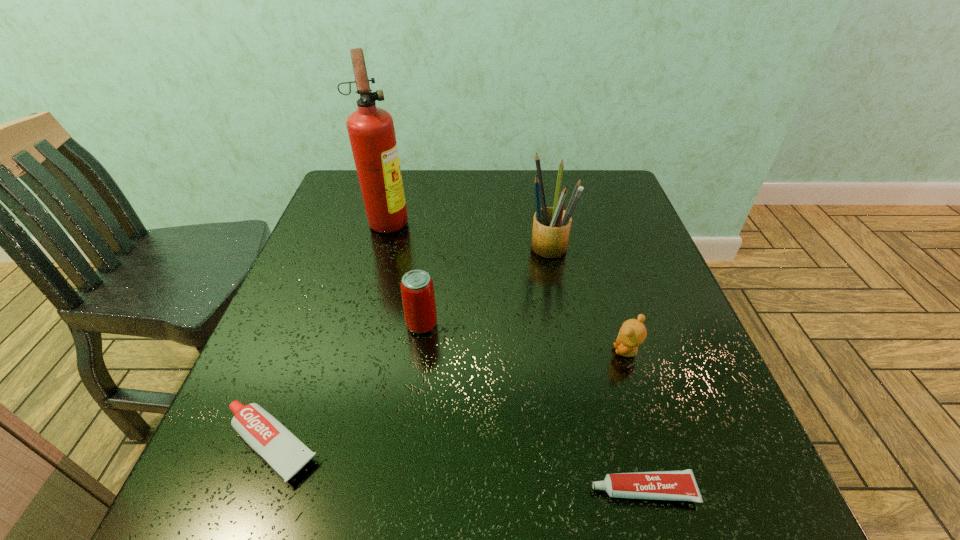
The width and height of the screenshot is (960, 540). In order to click on vacant space in between the tallest object and the taller toothpaste in this screenshot , I will do `click(329, 333)`.

At what (x,y) coordinates should I click in order to perform the action: click on free space between the second tallest object and the third tallest object. Please return your answer as a coordinate pair (x, y). The image size is (960, 540). Looking at the image, I should click on (486, 286).

The width and height of the screenshot is (960, 540). Find the location of `unoccupied area between the fifth tallest object and the teddy bear`. unoccupied area between the fifth tallest object and the teddy bear is located at coordinates (449, 398).

The width and height of the screenshot is (960, 540). What are the coordinates of `object that is the closest one to the fifth shortest object` in the screenshot? It's located at (633, 332).

I want to click on the third closest object to the third farthest object, so click(x=371, y=131).

The width and height of the screenshot is (960, 540). I want to click on free location that satisfies the following two spatial constraints: 1. on the back side of the left toothpaste; 2. on the left side of the beer can, so click(x=316, y=324).

The height and width of the screenshot is (540, 960). Identify the location of free region that satisfies the following two spatial constraints: 1. on the back side of the left toothpaste; 2. on the right side of the fourth object from right to left. (316, 324).

At what (x,y) coordinates should I click in order to perform the action: click on free location that satisfies the following two spatial constraints: 1. on the front-facing side of the beer can; 2. on the right side of the tallest object. Please return your answer as a coordinate pair (x, y). Looking at the image, I should click on (360, 324).

Locate an element on the screen. The image size is (960, 540). vacant space that satisfies the following two spatial constraints: 1. on the back side of the second tallest object; 2. on the front-facing side of the tallest object is located at coordinates (544, 220).